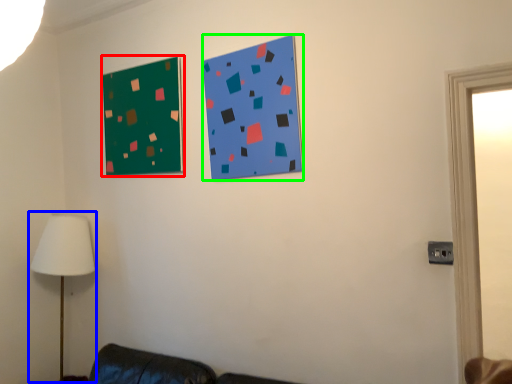
Question: Based on their relative distances, which object is farther from bulletin board (highlighted by a red box)? Choose from table lamp (highlighted by a blue box) and bulletin board (highlighted by a green box).

Choices:
 (A) table lamp
 (B) bulletin board

Answer: (A)